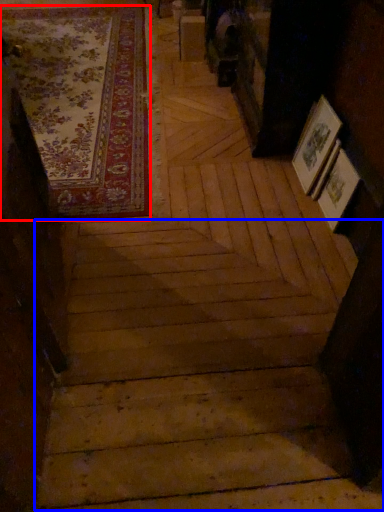
Question: Which of the following is the closest to the observer, mat (highlighted by a red box) or stairwell (highlighted by a blue box)?

Choices:
 (A) mat
 (B) stairwell

Answer: (B)